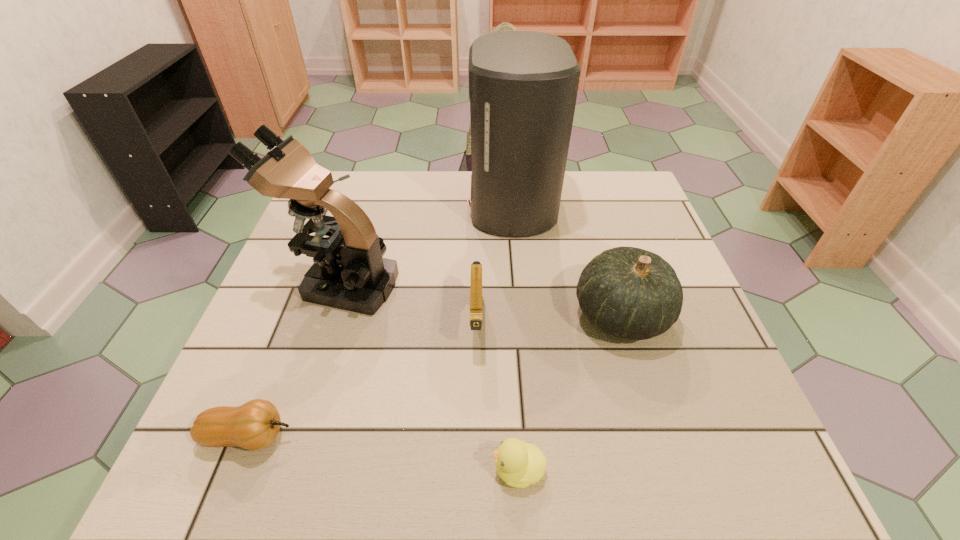
The height and width of the screenshot is (540, 960). What are the coordinates of `vacant space located on the button side of the coffee maker` in the screenshot? It's located at 384,205.

You are a GUI agent. You are given a task and a screenshot of the screen. Output one action in this format:
    pyautogui.click(x=<x>, y=<y>)
    Task: Click on the blank space located on the front of the second tallest object
    The image size is (960, 540).
    Given the screenshot: What is the action you would take?
    pyautogui.click(x=306, y=393)

Locate an element on the screen. free space located 0.190m on the back of the farther gourd is located at coordinates (x=595, y=231).

Where is `free region located at the barrel of the pistol`? The height and width of the screenshot is (540, 960). free region located at the barrel of the pistol is located at coordinates [x=476, y=384].

The image size is (960, 540). In order to click on free spot located 0.050m on the stem side of the nearer gourd in this screenshot , I will do `click(324, 436)`.

Find the location of a particular element. vacant space located at the beak of the duckling is located at coordinates (331, 469).

What are the coordinates of `free space located at the beak of the duckling` in the screenshot? It's located at (349, 469).

At what (x,y) coordinates should I click in order to perform the action: click on vacant area located at the beak of the duckling. Please return your answer as a coordinate pair (x, y). This screenshot has height=540, width=960. Looking at the image, I should click on [x=399, y=469].

Find the location of a particular element. The height and width of the screenshot is (540, 960). object positioned at the far edge is located at coordinates (523, 85).

This screenshot has height=540, width=960. I want to click on gourd positioned at the near edge, so click(x=254, y=425).